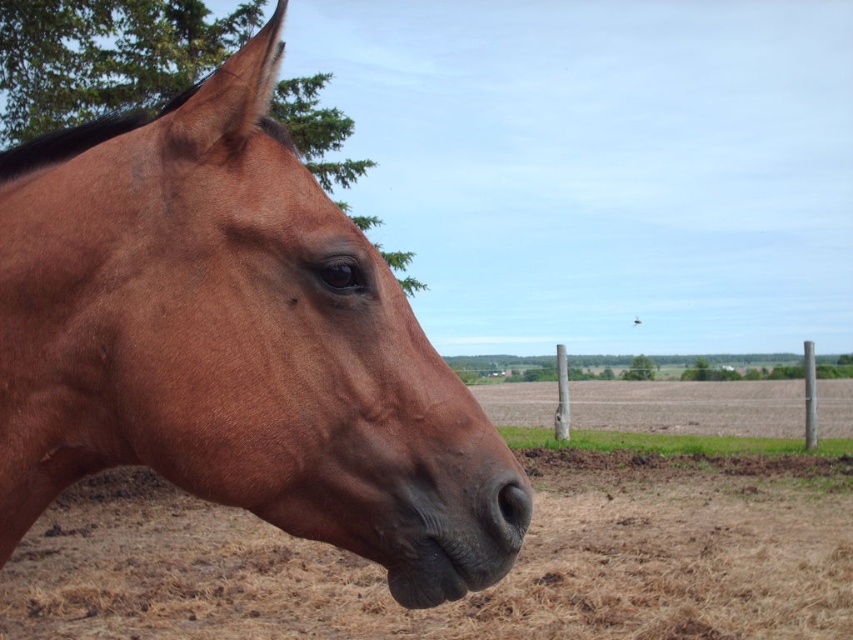
You are a photographer aiming to capture the shiny brown horse at left and the black matte nose at center in a single frame. Based on their positions, which object should you focus on first if you want to ensure both are in focus?

The shiny brown horse at left is taller than the black matte nose at center, so focusing on the shiny brown horse at left first would ensure both are in focus as it is the larger subject.

You are a photographer setting up a shot of the horse. You need to place a small tripod between the brown dirt field at lower left and the wooden post at center. Can you fit the tripod there if the tripod requires 1 meter of space?

The brown dirt field at lower left might be wider than wooden post at center, but since the exact width isn t specified, it s uncertain if the 1 meter space is available. Check the actual distance before placing the tripod.